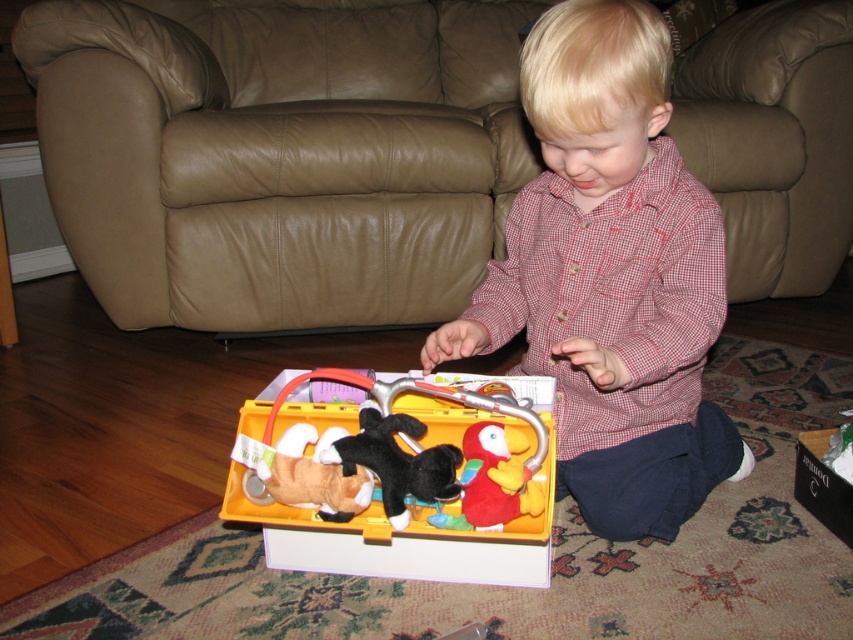
You are a parent trying to place a small nightlight on the floor between the brown leather armchair at center and the black plush toy at center. The nightlight requires 1 meter of space to function properly. Can you safely place it there?

The brown leather armchair at center is 1.19 meters away from the black plush toy at center. Since the required space is 1 meter, the nightlight can be safely placed between them as there is enough distance.

You are a parent trying to place a new plant stand between the brown leather armchair at center and the yellow plastic toolbox at center. Can you fit it vertically between them?

The brown leather armchair at center is above the yellow plastic toolbox at center, so the vertical space between them is sufficient to fit the plant stand.

You are standing at point (271, 524) and want to walk to the sofa. There is an obstacle at point (315, 202). Can you reach the sofa without passing through the obstacle?

Point (315, 202) is behind point (271, 524), so you can reach the sofa without passing through the obstacle.